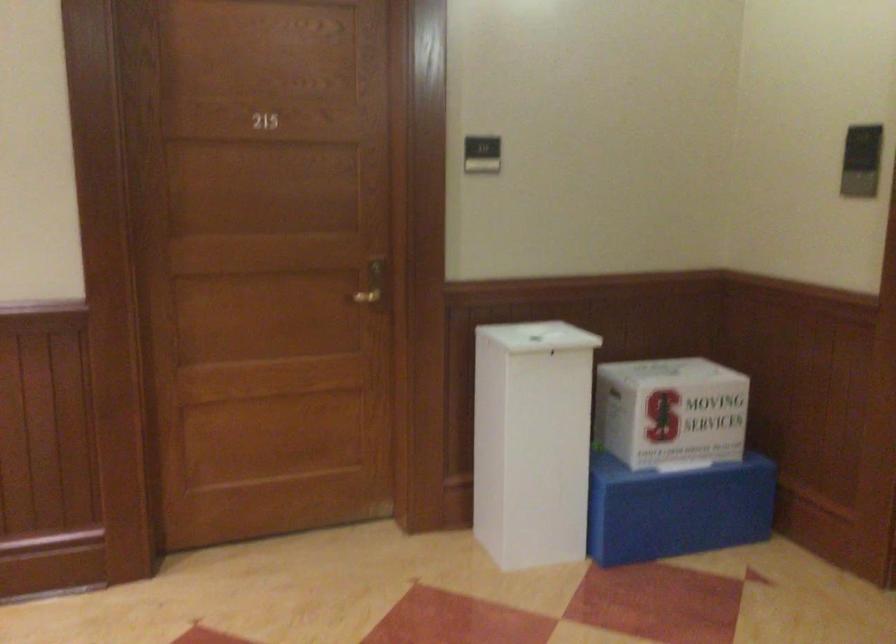
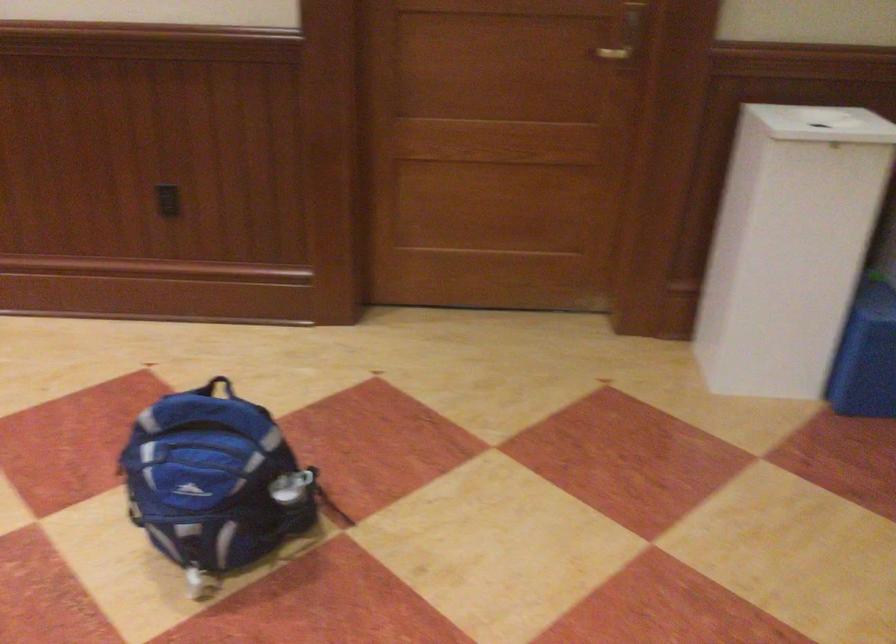
The point at (373, 287) is marked in the first image. Where is the corresponding point in the second image?

(625, 40)